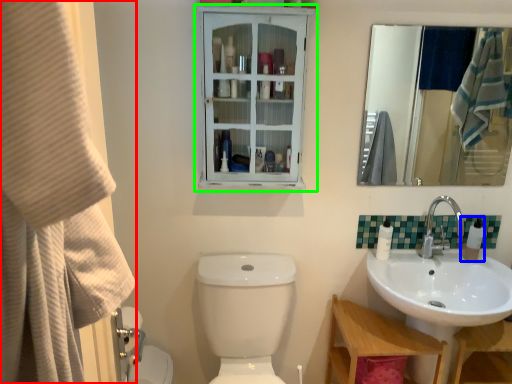
Question: Which object is positioned closest to shower curtain (highlighted by a red box)? Select from soap dispenser (highlighted by a blue box) and medicine cabinet (highlighted by a green box).

Choices:
 (A) soap dispenser
 (B) medicine cabinet

Answer: (B)